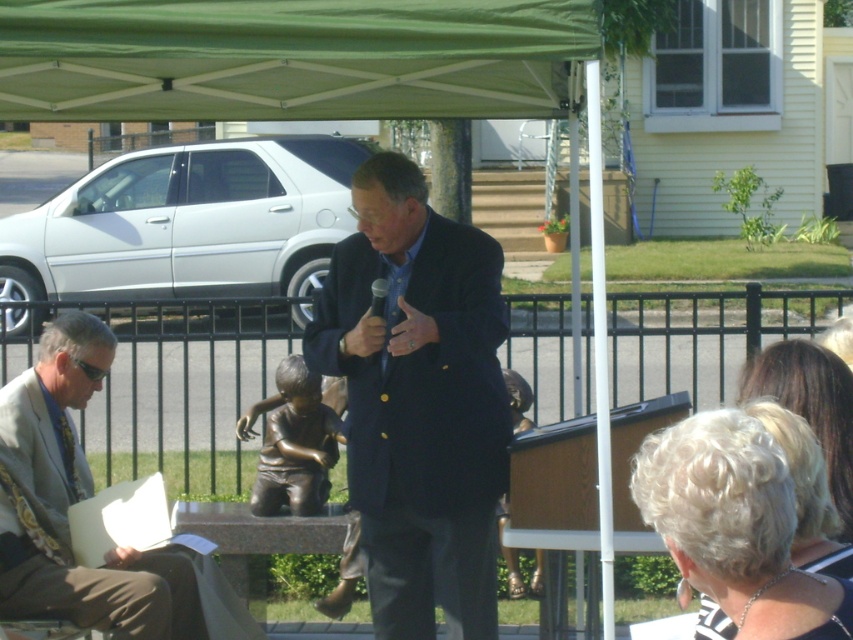
Question: Can you confirm if dark blue suit at center is positioned below gray suit at left?

Choices:
 (A) yes
 (B) no

Answer: (B)

Question: Can you confirm if dark blue suit at center is positioned to the left of gray suit at left?

Choices:
 (A) yes
 (B) no

Answer: (B)

Question: Is dark blue suit at center to the right of gray suit at left from the viewer's perspective?

Choices:
 (A) yes
 (B) no

Answer: (A)

Question: Which of the following is the farthest from the observer?

Choices:
 (A) (30, 516)
 (B) (434, 378)

Answer: (A)